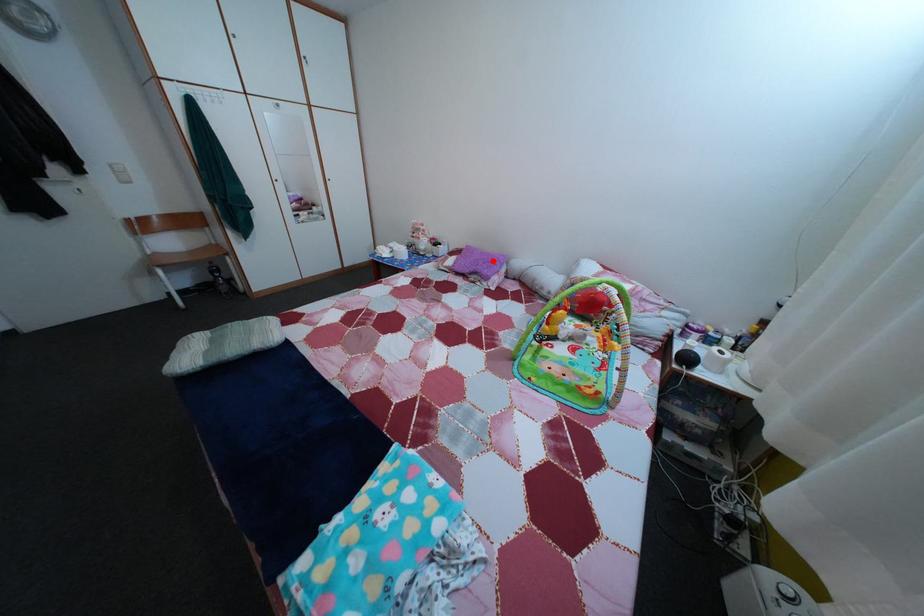
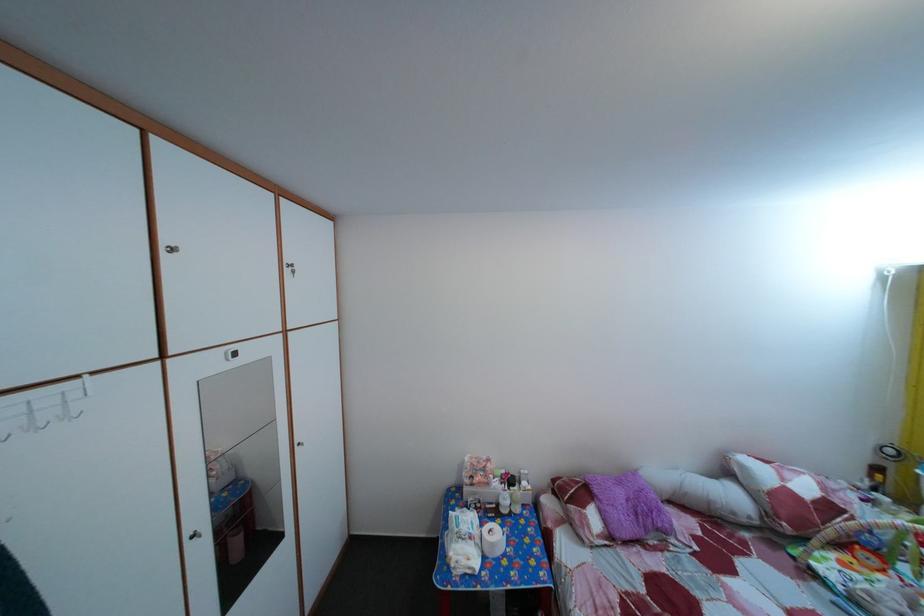
Locate, in the second image, the point that corresponds to the highlighted location in the first image.

(629, 491)